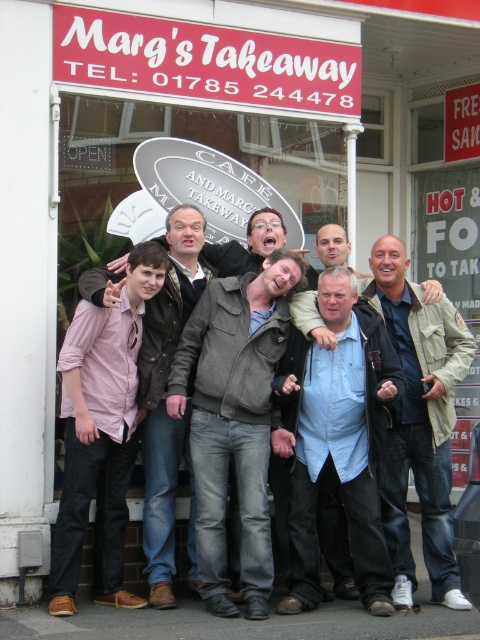
You are a photographer trying to capture a photo of the group at Margs Takeaway. You want to ensure both the dark grey textured jacket at center and the khaki cotton jacket at center are visible. Which jacket should you focus on first to make sure both are in frame?

The dark grey textured jacket at center is positioned on the left side of the khaki cotton jacket at center, so you should focus on the khaki cotton jacket at center first to ensure both are in frame.

You are a photographer taking a group photo at Margs Takeaway. You notice the blue denim shirt at center and the khaki cotton jacket at center. Which clothing item is smaller in size?

The blue denim shirt at center is smaller in size compared to the khaki cotton jacket at center.